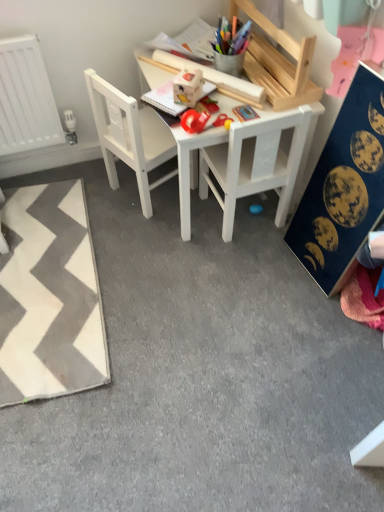
Locate an element on the screen. vacant space to the left of dark blue fabric with celestial prints at right is located at coordinates (260, 272).